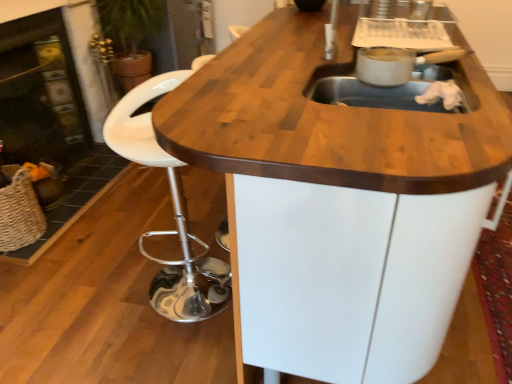
Question: Does woven straw basket at lower left have a greater height compared to matte black fireplace at left, the 1th fireplace when ordered from left to right?

Choices:
 (A) no
 (B) yes

Answer: (A)

Question: Is woven straw basket at lower left closer to the viewer compared to matte black fireplace at left, the 1th fireplace when ordered from left to right?

Choices:
 (A) no
 (B) yes

Answer: (B)

Question: Does woven straw basket at lower left appear on the left side of matte black fireplace at left, the 1th fireplace when ordered from left to right?

Choices:
 (A) no
 (B) yes

Answer: (A)

Question: Is woven straw basket at lower left oriented away from matte black fireplace at left, the second fireplace viewed from the right?

Choices:
 (A) no
 (B) yes

Answer: (A)

Question: Is woven straw basket at lower left outside matte black fireplace at left, the second fireplace viewed from the right?

Choices:
 (A) no
 (B) yes

Answer: (B)

Question: Considering the relative sizes of woven straw basket at lower left and matte black fireplace at left, the 1th fireplace when ordered from left to right, in the image provided, is woven straw basket at lower left bigger than matte black fireplace at left, the 1th fireplace when ordered from left to right,?

Choices:
 (A) yes
 (B) no

Answer: (B)

Question: Is matte black fireplace at left, the second fireplace viewed from the right, looking in the opposite direction of woven straw basket at lower left?

Choices:
 (A) no
 (B) yes

Answer: (A)

Question: Is matte black fireplace at left, the 1th fireplace when ordered from left to right, smaller than woven straw basket at lower left?

Choices:
 (A) yes
 (B) no

Answer: (B)

Question: Considering the relative positions of matte black fireplace at left, the 1th fireplace when ordered from left to right, and woven straw basket at lower left in the image provided, is matte black fireplace at left, the 1th fireplace when ordered from left to right, in front of woven straw basket at lower left?

Choices:
 (A) yes
 (B) no

Answer: (B)

Question: Is matte black fireplace at left, the 1th fireplace when ordered from left to right, thinner than woven straw basket at lower left?

Choices:
 (A) yes
 (B) no

Answer: (A)

Question: Does matte black fireplace at left, the 1th fireplace when ordered from left to right, turn towards woven straw basket at lower left?

Choices:
 (A) no
 (B) yes

Answer: (A)

Question: Is matte black fireplace at left, the second fireplace viewed from the right, not close to woven straw basket at lower left?

Choices:
 (A) yes
 (B) no

Answer: (B)

Question: Does black glass fireplace at left, placed as the first fireplace when sorted from right to left, contain woven straw basket at lower left?

Choices:
 (A) yes
 (B) no

Answer: (B)